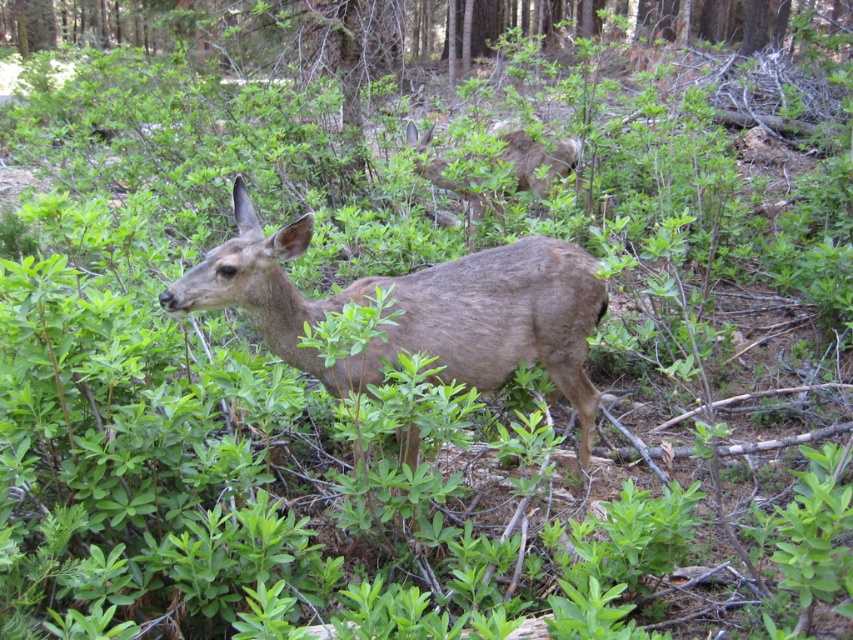
You are an animal researcher observing two deer in a forest. You see a brown fur deer at center and a brown furry deer at upper center. Which deer is taller?

The brown fur deer at center is taller than the brown furry deer at upper center.

You are a wildlife photographer aiming to capture the brown fur deer at center in the frame. According to the coordinates provided, where should you position your camera to ensure the deer is centered in your shot?

The brown fur deer at center is located at coordinates point (x=418, y=308), so positioning the camera at those coordinates will center the deer in the shot.